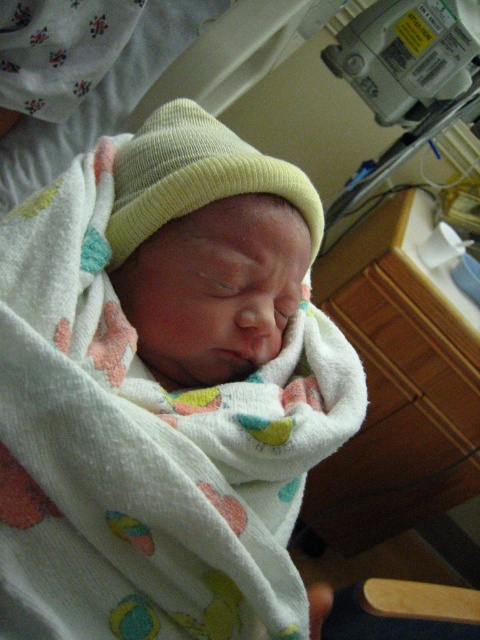
Looking at this image, you are a nurse checking on the newborn baby. You need to ensure that the light yellow knit hat at center does not fall off while adjusting the white soft blanket at center. Based on their sizes, can the blanket potentially cover the hat without slipping off?

The white soft blanket at center might be wider than light yellow knit hat at center, so there is a possibility that the blanket could cover the hat without it slipping off, provided the blanket is positioned correctly.

You are a nurse in a hospital nursery. You need to determine which item is bigger between the white soft blanket at center and the light yellow knit hat at center. Which one is larger?

The white soft blanket at center is larger than the light yellow knit hat at center according to the description.

You are a nurse checking on a newborn in the hospital. You need to place a small medical tool on the table between the white soft blanket at center and the light yellow knit hat at center. Is there enough space between them to place the tool?

The distance between the white soft blanket at center and the light yellow knit hat at center is 3.74 inches, so yes, there is enough space to place the tool between them.